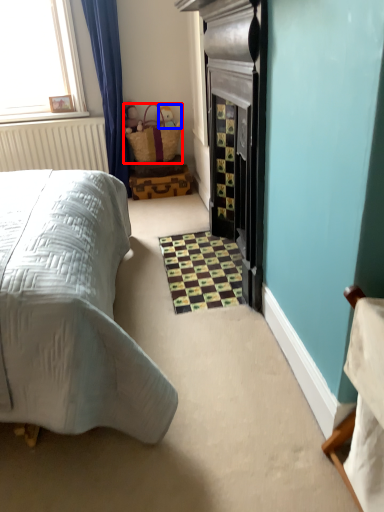
Question: Which of the following is the closest to the observer, basket (highlighted by a red box) or toy (highlighted by a blue box)?

Choices:
 (A) basket
 (B) toy

Answer: (A)